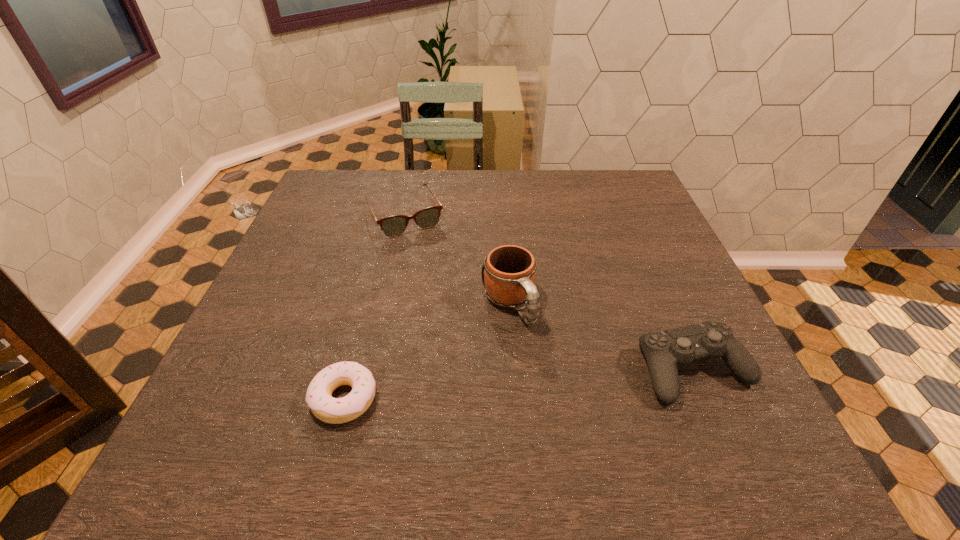
Find the location of a particular element. doughnut is located at coordinates (319, 398).

Identify the location of the second tallest object. Image resolution: width=960 pixels, height=540 pixels. click(664, 350).

This screenshot has height=540, width=960. Identify the location of control. (664, 350).

Where is `the farthest object`? the farthest object is located at coordinates (395, 225).

Where is `spectacles`? This screenshot has height=540, width=960. spectacles is located at coordinates (395, 225).

In order to click on the tallest object in this screenshot , I will do `click(509, 275)`.

Image resolution: width=960 pixels, height=540 pixels. What are the coordinates of `mug` in the screenshot? It's located at (509, 275).

At what (x,y) coordinates should I click in order to perform the action: click on free space located on the back of the doughnut. Please return your answer as a coordinate pair (x, y). Looking at the image, I should click on (363, 329).

Where is `free location located 0.290m on the left of the third shortest object`? The height and width of the screenshot is (540, 960). free location located 0.290m on the left of the third shortest object is located at coordinates pyautogui.click(x=492, y=369).

The width and height of the screenshot is (960, 540). Find the location of `vacant space located at the front view of the farthest object`. vacant space located at the front view of the farthest object is located at coordinates (467, 328).